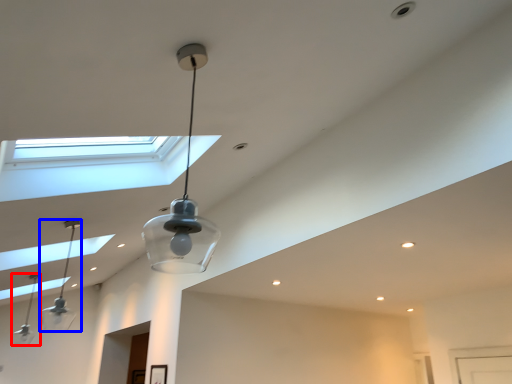
Question: Which object is further to the camera taking this photo, lamp (highlighted by a red box) or lamp (highlighted by a blue box)?

Choices:
 (A) lamp
 (B) lamp

Answer: (A)